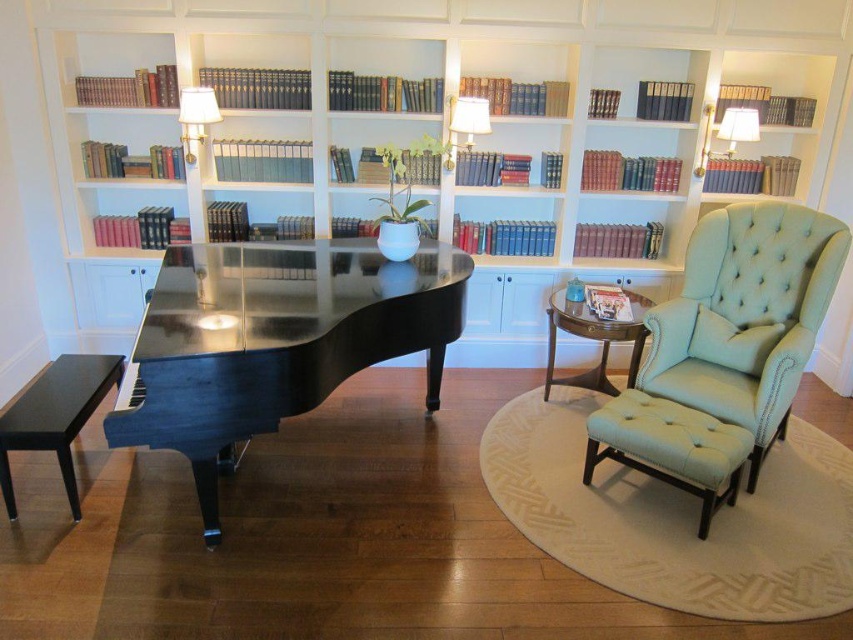
Can you confirm if white wood bookcase at center is shorter than black polished wood stool at lower left?

Incorrect, white wood bookcase at center's height does not fall short of black polished wood stool at lower left's.

Describe the element at coordinates (408, 131) in the screenshot. I see `white wood bookcase at center` at that location.

Between point (567, 68) and point (62, 465), which one is positioned in front?

Point (62, 465)

What are the coordinates of `white wood bookcase at center` in the screenshot? It's located at (408, 131).

Is light green leather swivel chair at right shorter than mahogany wood side table at center?

Incorrect, light green leather swivel chair at right's height does not fall short of mahogany wood side table at center's.

Based on the photo, measure the distance between point [683,273] and camera.

Point [683,273] is 3.38 meters from camera.

I want to click on light green leather swivel chair at right, so click(x=746, y=316).

Is point (302, 365) positioned behind point (57, 406)?

No, (302, 365) is in front of (57, 406).

Is glossy black piano at center thinner than black polished wood stool at lower left?

Incorrect, glossy black piano at center's width is not less than black polished wood stool at lower left's.

The width and height of the screenshot is (853, 640). Describe the element at coordinates (274, 340) in the screenshot. I see `glossy black piano at center` at that location.

At what (x,y) coordinates should I click in order to perform the action: click on glossy black piano at center. Please return your answer as a coordinate pair (x, y). The height and width of the screenshot is (640, 853). Looking at the image, I should click on (274, 340).